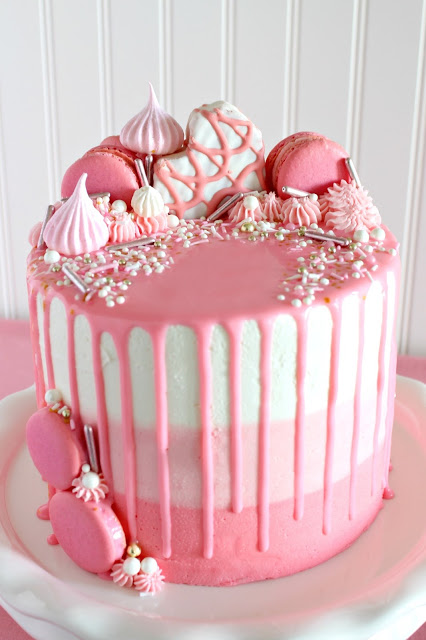
What are the coordinates of `topmost decorative piece` in the screenshot? It's located at click(x=148, y=127).